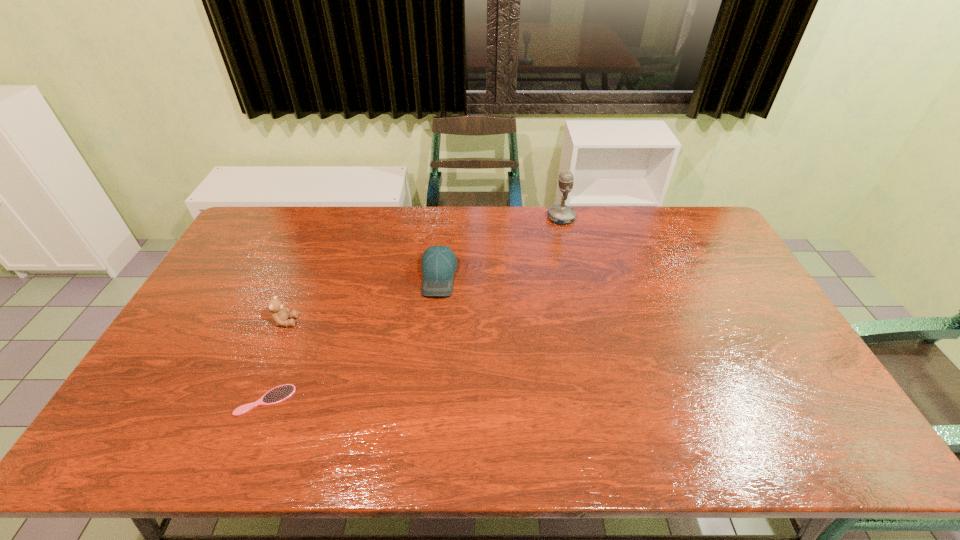
The height and width of the screenshot is (540, 960). I want to click on vacant space situated on the face of the teddy bear, so click(x=420, y=322).

In order to click on vacant position located 0.210m on the front of the baseball cap in this screenshot , I will do `click(430, 355)`.

The image size is (960, 540). In order to click on vacant region located 0.110m on the right of the hairbrush in this screenshot , I will do `click(336, 400)`.

At what (x,y) coordinates should I click in order to perform the action: click on object that is at the far edge. Please return your answer as a coordinate pair (x, y). This screenshot has width=960, height=540. Looking at the image, I should click on (561, 214).

This screenshot has width=960, height=540. In the image, there is a desktop. Identify the location of vacant space at the far edge. pos(596,239).

Where is `vacant space at the left edge of the desktop`? This screenshot has width=960, height=540. vacant space at the left edge of the desktop is located at coordinates (262, 256).

The height and width of the screenshot is (540, 960). Find the location of `blank space at the right edge of the desktop`. blank space at the right edge of the desktop is located at coordinates (726, 299).

In order to click on free space at the far left corner in this screenshot , I will do `click(294, 217)`.

Locate an element on the screen. vacant space at the far right corner of the desktop is located at coordinates (709, 220).

In order to click on empty space between the shortest object and the teddy bear in this screenshot , I will do `click(276, 361)`.